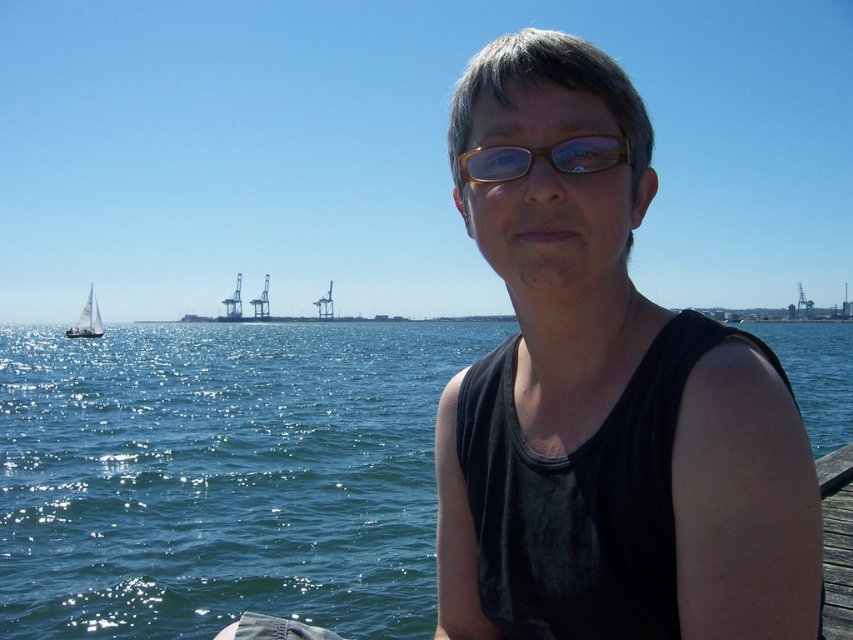
Question: Which point appears farthest from the camera in this image?

Choices:
 (A) (312, 481)
 (B) (558, 148)
 (C) (96, 320)
 (D) (694, 572)

Answer: (C)

Question: Can you confirm if glistening blue water at lower left is wider than wooden at right?

Choices:
 (A) no
 (B) yes

Answer: (B)

Question: Does glistening blue water at lower left lie behind white sailboat at left?

Choices:
 (A) no
 (B) yes

Answer: (A)

Question: Does transparent plastic glasses at center have a larger size compared to white sailboat at left?

Choices:
 (A) no
 (B) yes

Answer: (A)

Question: Which object appears closest to the camera in this image?

Choices:
 (A) black matte tank top at center
 (B) glistening blue water at lower left

Answer: (A)

Question: Among these objects, which one is nearest to the camera?

Choices:
 (A) wooden at right
 (B) black matte tank top at center
 (C) transparent plastic glasses at center

Answer: (B)